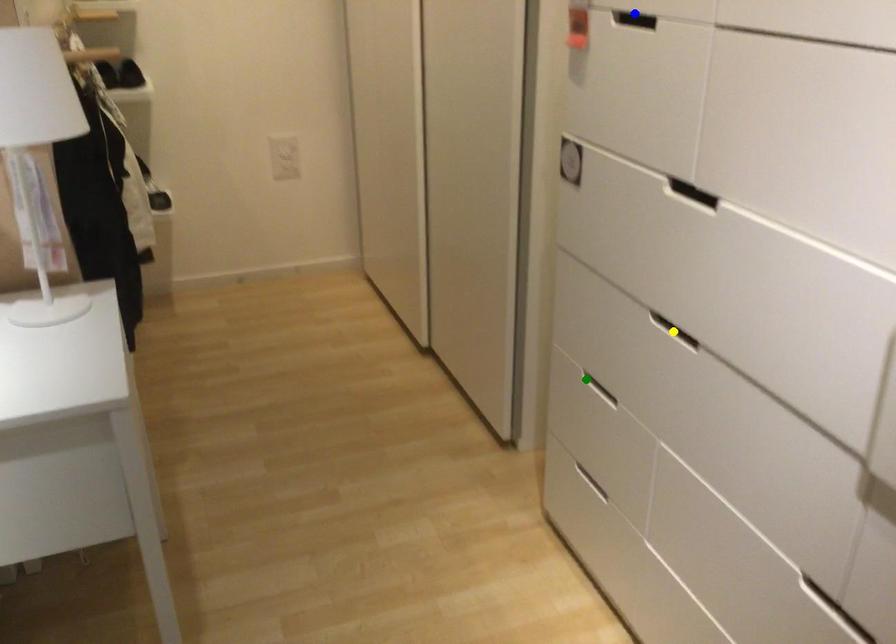
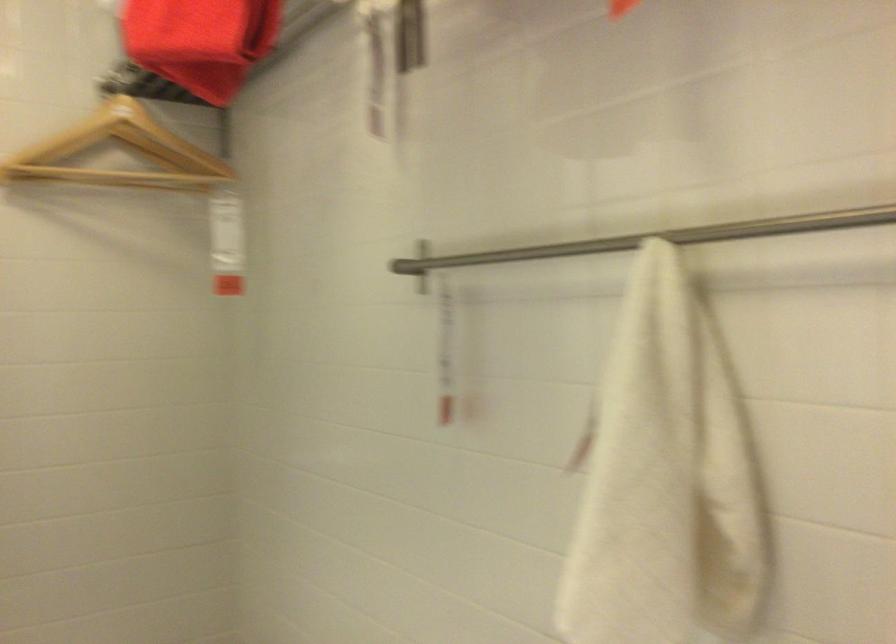
I am providing you with two images of the same scene from different viewpoints. Three points are marked in image1. Which point corresponds to a part or object that is occluded in image2?In image1, three points are marked. Which of them correspond to a part or object that is occluded in image2?Among the three points shown in image1, which one corresponds to a part or object that is no longer visible due to occlusion in image2?

green point, blue point, yellow point